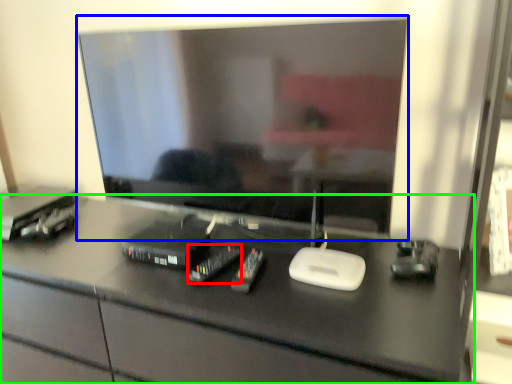
Question: Estimate the real-world distances between objects in this image. Which object is closer to equipment (highlighted by a red box), television (highlighted by a blue box) or desk (highlighted by a green box)?

Choices:
 (A) television
 (B) desk

Answer: (B)